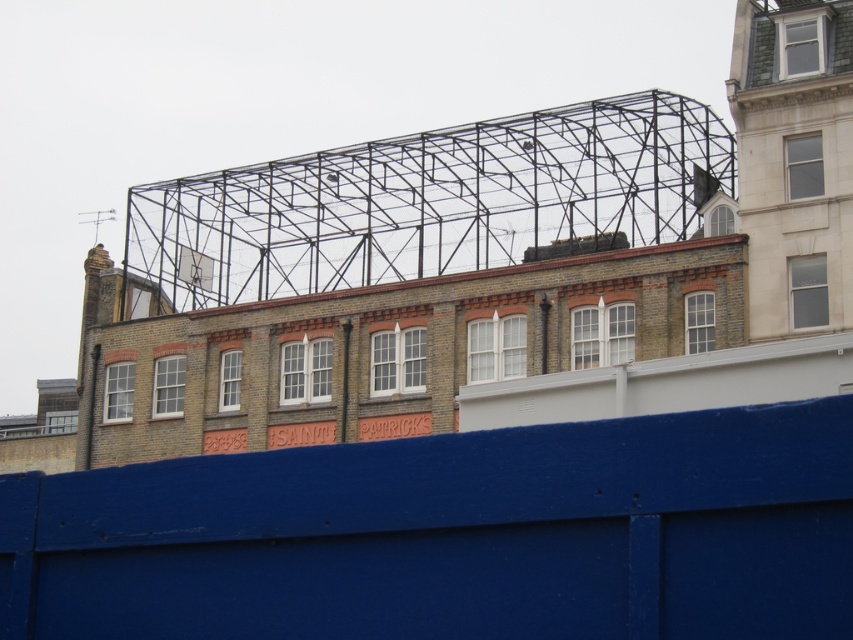
Question: Can you confirm if blue painted wood at center is positioned to the right of black metal scaffolding at upper center?

Choices:
 (A) yes
 (B) no

Answer: (A)

Question: Is blue painted wood at center to the right of black metal scaffolding at upper center from the viewer's perspective?

Choices:
 (A) no
 (B) yes

Answer: (B)

Question: Is blue painted wood at center above black metal scaffolding at upper center?

Choices:
 (A) no
 (B) yes

Answer: (A)